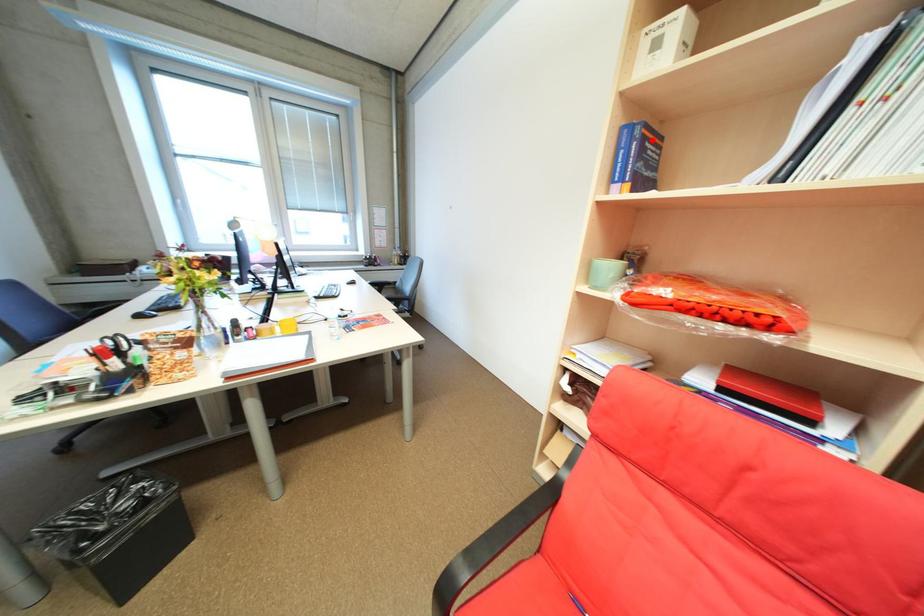
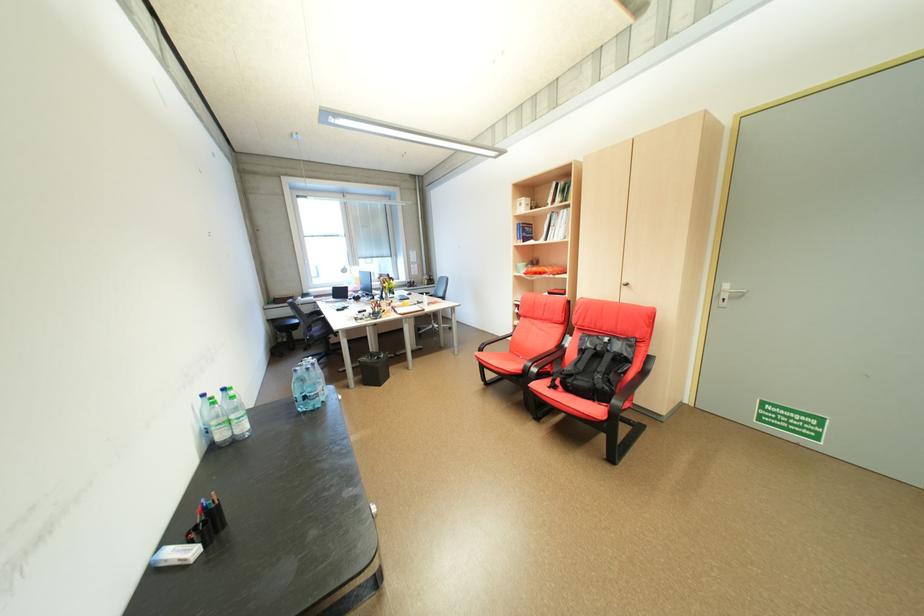
Where in the second image is the point corresponding to the highlighted location from the first image?

(532, 228)